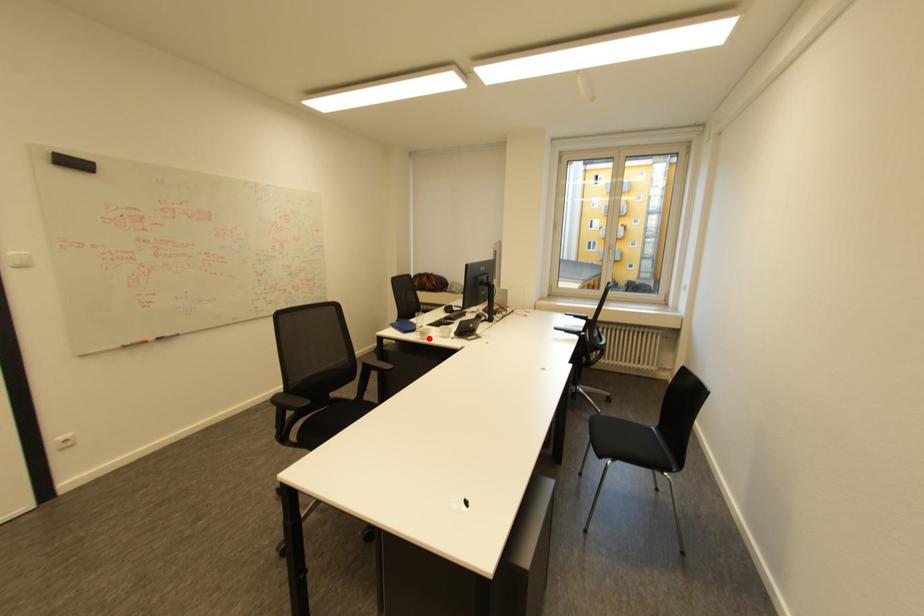
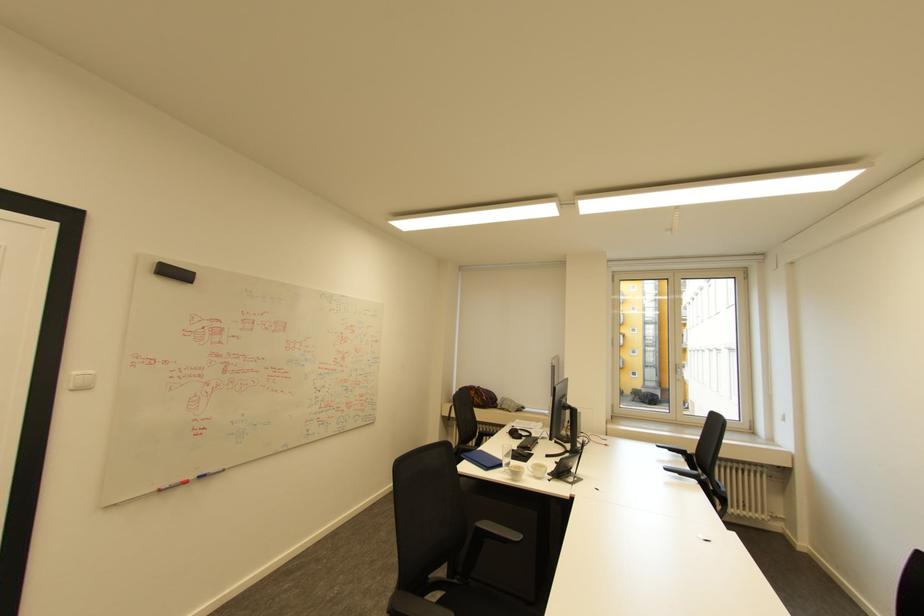
Find the pixel in the second image that matches the highlighted location in the first image.

(518, 479)